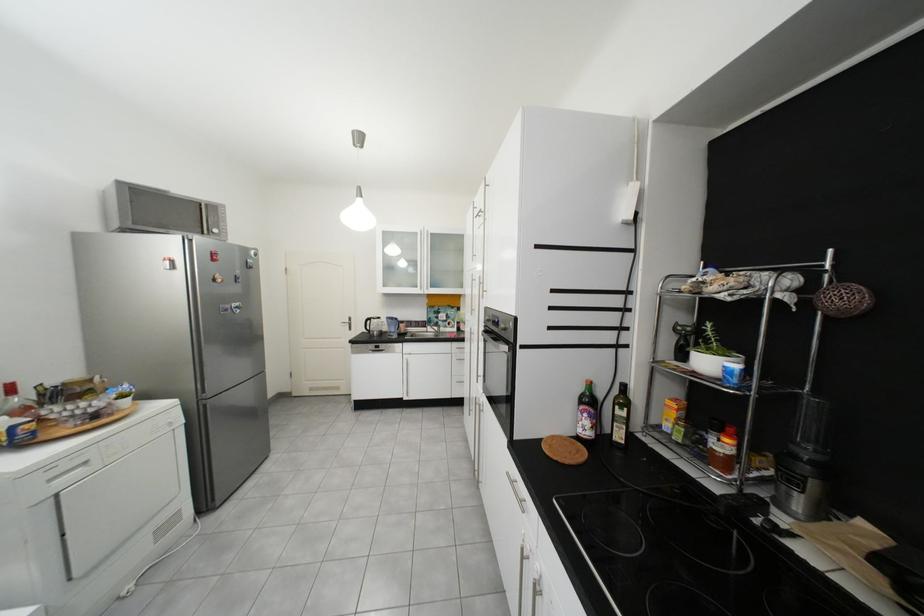
Describe the element at coordinates (351, 325) in the screenshot. Image resolution: width=924 pixels, height=616 pixels. I see `a white door handle` at that location.